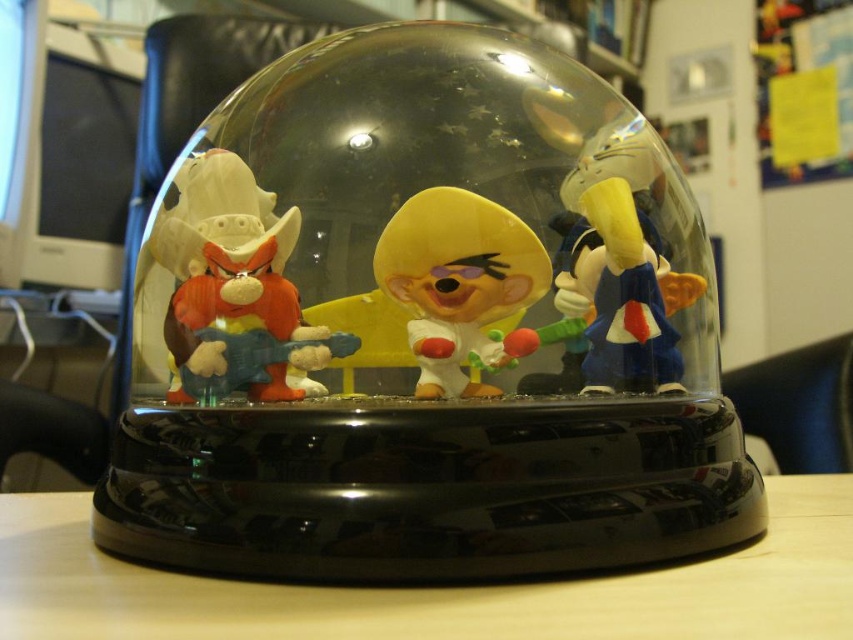
Question: Which of these objects is positioned farthest from the matte plastic toy at center?

Choices:
 (A) matte plastic figurine at left
 (B) wooden at center
 (C) yellow matte figurine at center

Answer: (B)

Question: Does wooden at center lie in front of yellow matte figurine at center?

Choices:
 (A) no
 (B) yes

Answer: (B)

Question: Which object is farther from the camera taking this photo?

Choices:
 (A) wooden at center
 (B) matte plastic figurine at left
 (C) matte plastic toy at center
 (D) yellow matte figurine at center

Answer: (B)

Question: Can you confirm if matte plastic figurine at left is positioned to the left of yellow matte figurine at center?

Choices:
 (A) yes
 (B) no

Answer: (A)

Question: Which point is closer to the camera?

Choices:
 (A) [x=213, y=268]
 (B) [x=260, y=540]

Answer: (B)

Question: In this image, where is matte plastic toy at center located relative to yellow matte figurine at center?

Choices:
 (A) below
 (B) above

Answer: (B)